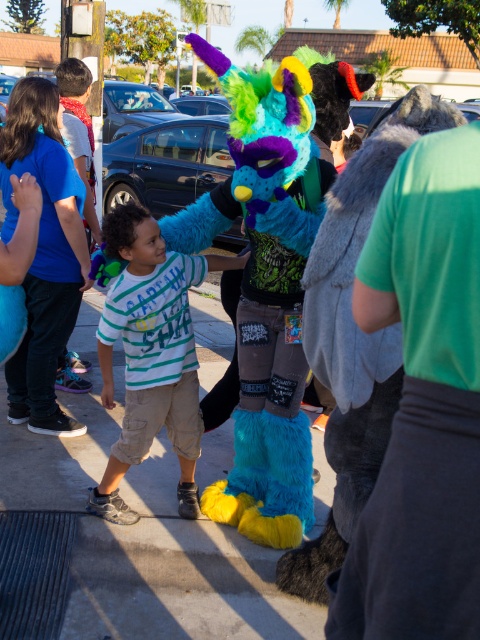
You are standing in the middle of the event and see two points in the scene. The first point is at coordinate point (192, 497) and the second is at point (87, 387). Which point is closer to you?

Point (192, 497) is closer to the viewer than point (87, 387).

You are a delivery robot navigating through the scene. You need to move from the smooth concrete pavement at center to the striped cotton shirt at center. Which direction should you move relative to your current position?

The smooth concrete pavement at center is in front of the striped cotton shirt at center, so to move from the pavement to the shirt, you should move backward.

You are a photographer at the event and need to position two shirts for a photo. The striped cotton shirt at center and the blue cotton shirt at left must be arranged so that the taller one is in the background for depth. Which shirt should be placed in the back?

The striped cotton shirt at center is taller than the blue cotton shirt at left, so the striped cotton shirt at center should be placed in the back to create depth.